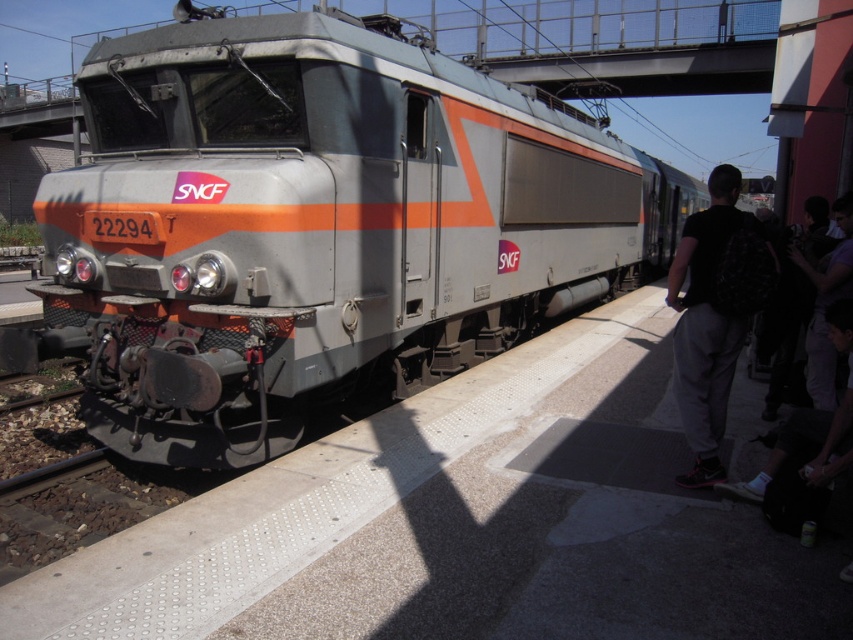
You are a photographer standing at the railway station. You want to take a photo of the metallic gray train at center and the dark purple shirt at right. Based on their heights, which object should you focus on first if you want to capture both in a single frame without adjusting your camera angle?

The metallic gray train at center is taller than the dark purple shirt at right, so you should focus on the metallic gray train at center first to ensure it is in frame before the shorter object.

You are standing on the platform at the railway station and see the SNCF locomotive numbered 22294. There is also a person wearing dark gray sweatpants at right. According to the coordinates provided, which object is closer to the front of the locomotive?

The dark gray sweatpants at right is located at point (714, 314), which is closer to the front of the locomotive compared to other objects since it is positioned near the platform edge where the front of the train is situated.